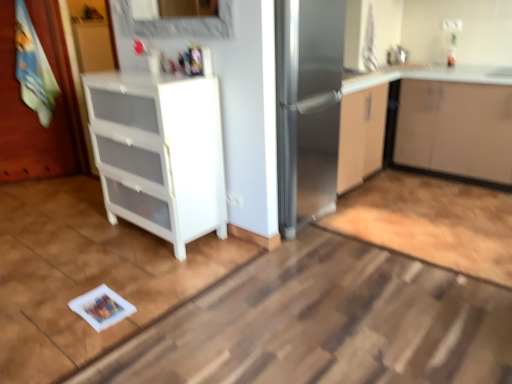
Question: Considering the relative sizes of white plastic drawer unit at left, positioned as the 1th cabinetry in left-to-right order, and matte white cabinet at upper right, which ranks as the second cabinetry in left-to-right order, in the image provided, is white plastic drawer unit at left, positioned as the 1th cabinetry in left-to-right order, bigger than matte white cabinet at upper right, which ranks as the second cabinetry in left-to-right order,?

Choices:
 (A) yes
 (B) no

Answer: (B)

Question: Is white plastic drawer unit at left, positioned as the 1th cabinetry in left-to-right order, at the left side of matte white cabinet at upper right, which ranks as the second cabinetry in left-to-right order?

Choices:
 (A) yes
 (B) no

Answer: (A)

Question: From the image's perspective, is white plastic drawer unit at left, positioned as the 1th cabinetry in left-to-right order, beneath matte white cabinet at upper right, which ranks as the second cabinetry in left-to-right order?

Choices:
 (A) yes
 (B) no

Answer: (A)

Question: Considering the relative sizes of white plastic drawer unit at left, the 2th cabinetry positioned from the right, and matte white cabinet at upper right, positioned as the 1th cabinetry in right-to-left order, in the image provided, is white plastic drawer unit at left, the 2th cabinetry positioned from the right, taller than matte white cabinet at upper right, positioned as the 1th cabinetry in right-to-left order,?

Choices:
 (A) yes
 (B) no

Answer: (A)

Question: Could you tell me if white plastic drawer unit at left, the 2th cabinetry positioned from the right, is turned towards matte white cabinet at upper right, positioned as the 1th cabinetry in right-to-left order?

Choices:
 (A) no
 (B) yes

Answer: (A)

Question: From a real-world perspective, relative to white plastic drawer unit at left, the 2th cabinetry positioned from the right, is wooden painted door at left vertically above or below?

Choices:
 (A) above
 (B) below

Answer: (A)

Question: In terms of height, does wooden painted door at left look taller or shorter compared to white plastic drawer unit at left, the 2th cabinetry positioned from the right?

Choices:
 (A) tall
 (B) short

Answer: (B)

Question: In the image, is wooden painted door at left on the left side or the right side of white plastic drawer unit at left, positioned as the 1th cabinetry in left-to-right order?

Choices:
 (A) left
 (B) right

Answer: (A)

Question: Is point (37, 160) positioned closer to the camera than point (166, 144)?

Choices:
 (A) farther
 (B) closer

Answer: (A)

Question: Is white plastic drawer unit at left, positioned as the 1th cabinetry in left-to-right order, wider or thinner than wooden painted door at left?

Choices:
 (A) wide
 (B) thin

Answer: (A)

Question: Considering the positions of white plastic drawer unit at left, the 2th cabinetry positioned from the right, and wooden painted door at left in the image, is white plastic drawer unit at left, the 2th cabinetry positioned from the right, bigger or smaller than wooden painted door at left?

Choices:
 (A) big
 (B) small

Answer: (A)

Question: From the image's perspective, is white plastic drawer unit at left, positioned as the 1th cabinetry in left-to-right order, positioned above or below wooden painted door at left?

Choices:
 (A) above
 (B) below

Answer: (B)

Question: From a real-world perspective, is white plastic drawer unit at left, the 2th cabinetry positioned from the right, positioned above or below wooden painted door at left?

Choices:
 (A) below
 (B) above

Answer: (A)

Question: Based on their sizes in the image, would you say matte white cabinet at upper right, which ranks as the second cabinetry in left-to-right order, is bigger or smaller than white plastic drawer unit at left, the 2th cabinetry positioned from the right?

Choices:
 (A) small
 (B) big

Answer: (B)

Question: In the image, is matte white cabinet at upper right, which ranks as the second cabinetry in left-to-right order, on the left side or the right side of white plastic drawer unit at left, positioned as the 1th cabinetry in left-to-right order?

Choices:
 (A) left
 (B) right

Answer: (B)